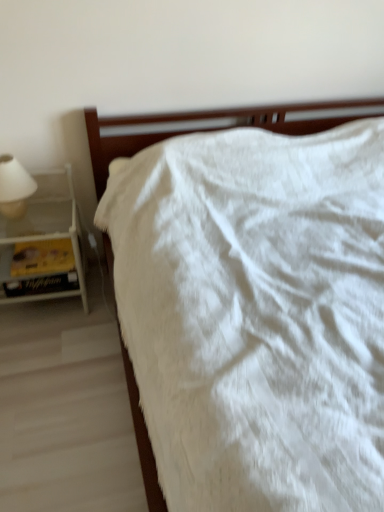
Question: Based on their positions, is yellow paper at left located to the left or right of white fluffy blanket at center?

Choices:
 (A) right
 (B) left

Answer: (B)

Question: Is yellow paper at left taller or shorter than white fluffy blanket at center?

Choices:
 (A) tall
 (B) short

Answer: (B)

Question: Which is nearer to the white matte lampshade at left?

Choices:
 (A) white glossy nightstand at left
 (B) white fluffy blanket at center
 (C) yellow paper at left

Answer: (A)

Question: Which of these objects is positioned farthest from the white fluffy blanket at center?

Choices:
 (A) white glossy nightstand at left
 (B) yellow paper at left
 (C) white matte lampshade at left

Answer: (B)